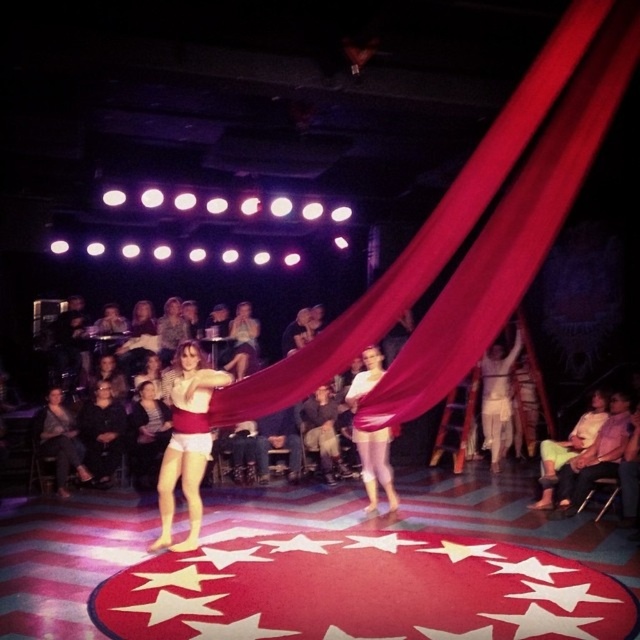
You are a stagehand preparing to adjust the lighting for the aerial act. You notice the matte red shorts at center and the dark gray fabric at center. Which object should you focus your spotlight on to ensure it covers the wider area?

The matte red shorts at center might be wider than dark gray fabric at center, so you should focus the spotlight on the matte red shorts at center to cover the wider area.

You are a stagehand observing the circus performance. You need to adjust the spotlight to focus on the higher object between the matte red shorts at center and the dark gray fabric at center. Which object should you focus on?

The matte red shorts at center has a greater height compared to the dark gray fabric at center, so you should focus the spotlight on the matte red shorts at center.

You are a stagehand observing the circus performance. You notice two points marked on the stage floor at coordinates point (205, 406) and point (100, 442). Which point is closer to the audience? Please answer based on the stage layout described.

Point (205, 406) is in front of point (100, 442), so it is closer to the audience.